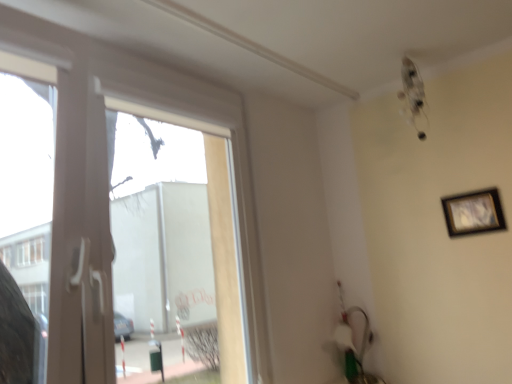
Question: Based on their positions, is transparent glass window at left located to the left or right of black matte picture frame at upper right?

Choices:
 (A) right
 (B) left

Answer: (B)

Question: Is transparent glass window at left wider or thinner than black matte picture frame at upper right?

Choices:
 (A) wide
 (B) thin

Answer: (A)

Question: Is transparent glass window at left taller or shorter than black matte picture frame at upper right?

Choices:
 (A) tall
 (B) short

Answer: (A)

Question: Considering the positions of black matte picture frame at upper right and transparent glass window at left in the image, is black matte picture frame at upper right taller or shorter than transparent glass window at left?

Choices:
 (A) tall
 (B) short

Answer: (B)

Question: Is black matte picture frame at upper right wider or thinner than transparent glass window at left?

Choices:
 (A) thin
 (B) wide

Answer: (A)

Question: Is black matte picture frame at upper right in front of or behind transparent glass window at left in the image?

Choices:
 (A) front
 (B) behind

Answer: (B)

Question: Does point (462, 213) appear closer or farther from the camera than point (56, 326)?

Choices:
 (A) farther
 (B) closer

Answer: (A)